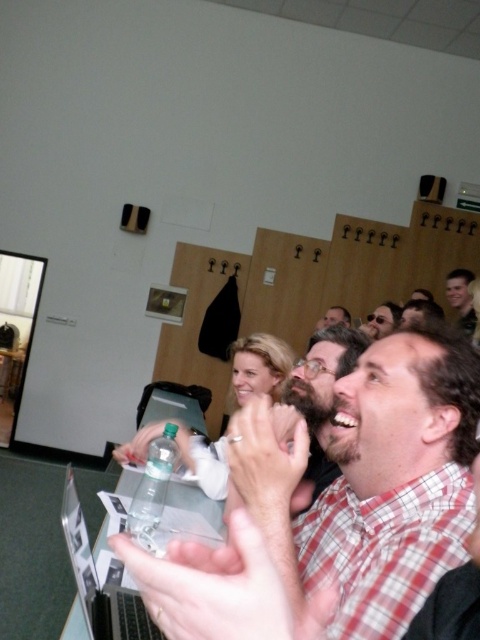
You are standing at the entrance of the conference room and want to locate the person wearing the plaid shirt at center. Based on the coordinates provided, in which direction should you look to find them?

The plaid shirt at center is located at coordinates point (371,483), which means you should look towards the lower right direction to find them.

You are organizing a group photo and need to arrange two individuals based on their clothing and hair. The plaid shirt at center and light brown hair at upper right must be positioned side by side. Which person should stand on the left to ensure the arrangement looks balanced?

The plaid shirt at center should stand on the left because its width is larger than the light brown hair at upper right, creating a balanced arrangement.